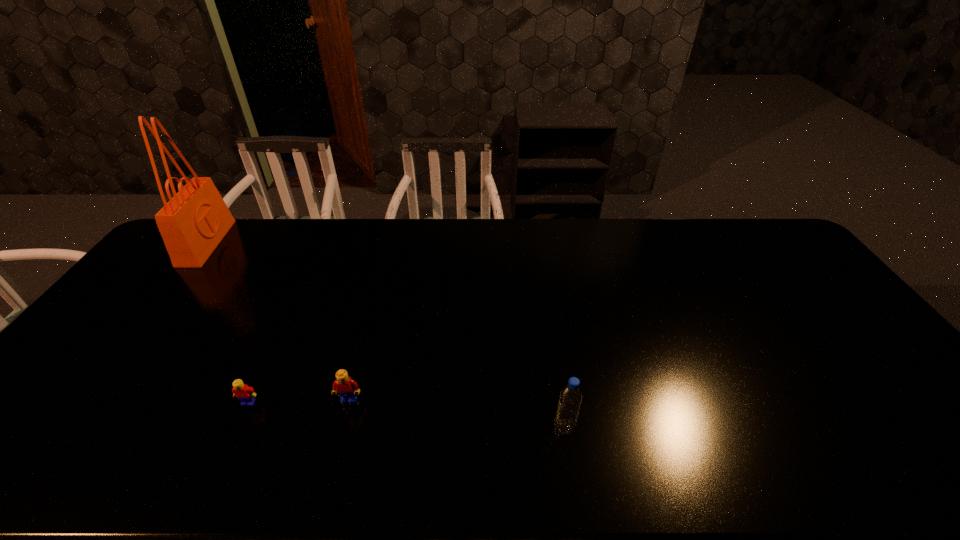
This screenshot has width=960, height=540. In order to click on free spot between the shorter Lego and the leftmost object in this screenshot , I will do `click(228, 323)`.

You are a GUI agent. You are given a task and a screenshot of the screen. Output one action in this format:
    pyautogui.click(x=<x>, y=<y>)
    Task: Click on the vacant area between the third object from left to right and the left Lego
    
    Given the screenshot: What is the action you would take?
    pyautogui.click(x=300, y=401)

I want to click on free space between the second object from left to right and the leftmost object, so click(228, 323).

The height and width of the screenshot is (540, 960). I want to click on vacant area that lies between the water bottle and the shorter Lego, so click(406, 415).

Identify the location of free spot between the farthest object and the second object from left to right. Image resolution: width=960 pixels, height=540 pixels. (228, 323).

This screenshot has width=960, height=540. I want to click on free space between the third object from right to left and the tote bag, so click(x=228, y=323).

Locate an element on the screen. unoccupied position between the leftmost object and the left Lego is located at coordinates (228, 323).

The height and width of the screenshot is (540, 960). In order to click on free spot between the shorter Lego and the rightmost object in this screenshot , I will do `click(406, 415)`.

Identify the location of object that stands as the second closest to the right Lego. (570, 399).

What are the coordinates of `the third closest object relative to the water bottle` in the screenshot? It's located at (192, 224).